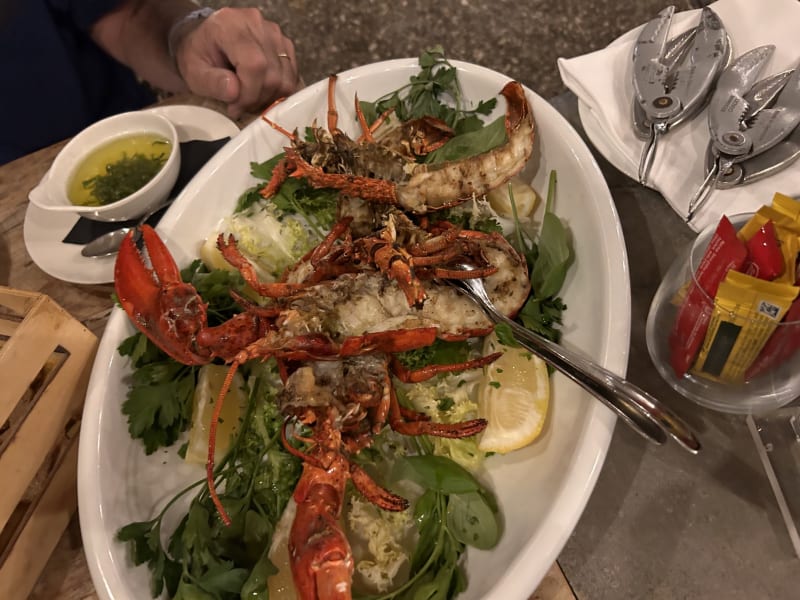
This screenshot has height=600, width=800. I want to click on table, so click(x=8, y=262).